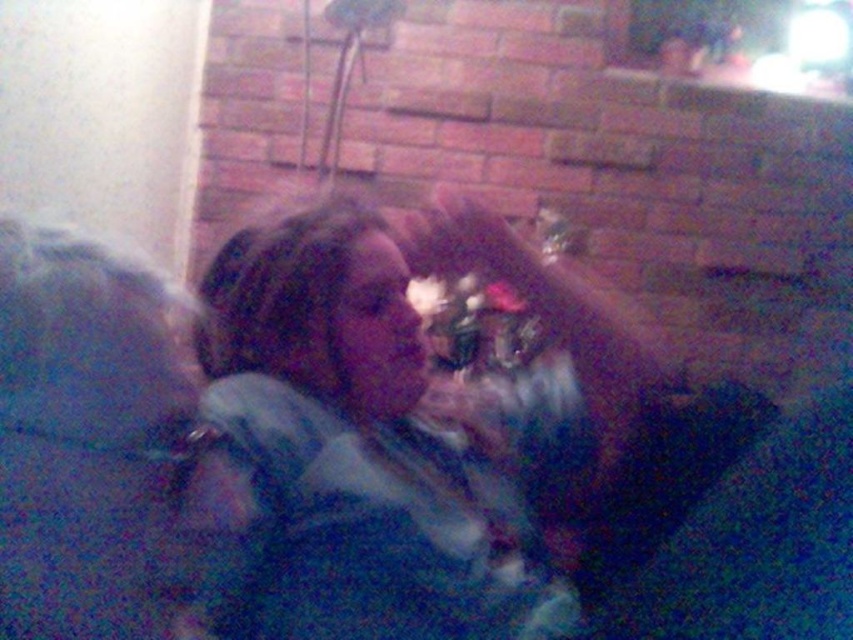
Which is more to the right, matte blue shirt at center or dark blue fabric at left?

From the viewer's perspective, matte blue shirt at center appears more on the right side.

Is the position of matte blue shirt at center more distant than that of dark blue fabric at left?

Yes.

The width and height of the screenshot is (853, 640). In order to click on matte blue shirt at center in this screenshot , I will do 389,433.

I want to click on matte blue shirt at center, so (389, 433).